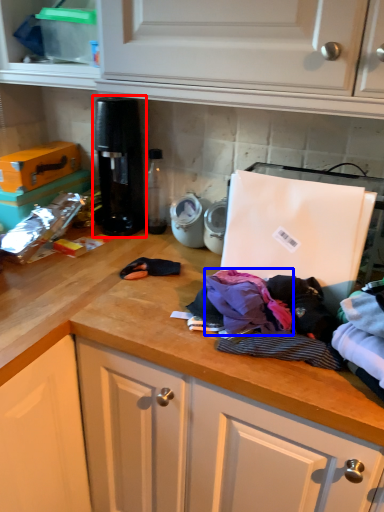
Question: Among these objects, which one is nearest to the camera, coffee machine (highlighted by a red box) or clothing (highlighted by a blue box)?

Choices:
 (A) coffee machine
 (B) clothing

Answer: (B)